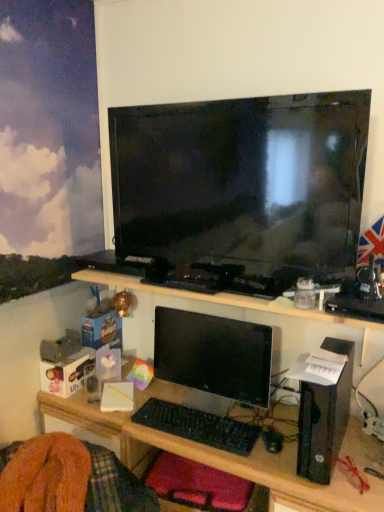
Question: Is black plastic keyboard at center far away from black glossy monitor at center?

Choices:
 (A) yes
 (B) no

Answer: (B)

Question: Is black glossy monitor at center at the back of black plastic keyboard at center?

Choices:
 (A) yes
 (B) no

Answer: (A)

Question: Does black plastic keyboard at center have a smaller size compared to black glossy monitor at center?

Choices:
 (A) no
 (B) yes

Answer: (B)

Question: Does black plastic keyboard at center have a larger size compared to black glossy monitor at center?

Choices:
 (A) no
 (B) yes

Answer: (A)

Question: From a real-world perspective, is black plastic keyboard at center positioned over black glossy monitor at center based on gravity?

Choices:
 (A) yes
 (B) no

Answer: (B)

Question: Based on their positions, is black glossy monitor at center located to the left or right of black glossy tv at upper center?

Choices:
 (A) right
 (B) left

Answer: (B)

Question: In the image, is black glossy monitor at center positioned in front of or behind black glossy tv at upper center?

Choices:
 (A) behind
 (B) front

Answer: (A)

Question: In terms of width, does black glossy monitor at center look wider or thinner when compared to black glossy tv at upper center?

Choices:
 (A) thin
 (B) wide

Answer: (A)

Question: From a real-world perspective, is black glossy monitor at center physically located above or below black glossy tv at upper center?

Choices:
 (A) below
 (B) above

Answer: (A)

Question: Considering their positions, is black glossy monitor at center located in front of or behind black plastic mouse at lower center?

Choices:
 (A) front
 (B) behind

Answer: (B)

Question: From the image's perspective, relative to black plastic mouse at lower center, is black glossy monitor at center above or below?

Choices:
 (A) above
 (B) below

Answer: (A)

Question: Looking at the image, does black glossy monitor at center seem bigger or smaller compared to black plastic mouse at lower center?

Choices:
 (A) small
 (B) big

Answer: (B)

Question: From their relative heights in the image, would you say black glossy monitor at center is taller or shorter than black plastic mouse at lower center?

Choices:
 (A) short
 (B) tall

Answer: (B)

Question: Relative to velvet-like red cushion at lower center, is black glossy tv at upper center in front or behind?

Choices:
 (A) front
 (B) behind

Answer: (A)

Question: Which is correct: black glossy tv at upper center is inside velvet-like red cushion at lower center, or outside of it?

Choices:
 (A) inside
 (B) outside

Answer: (B)